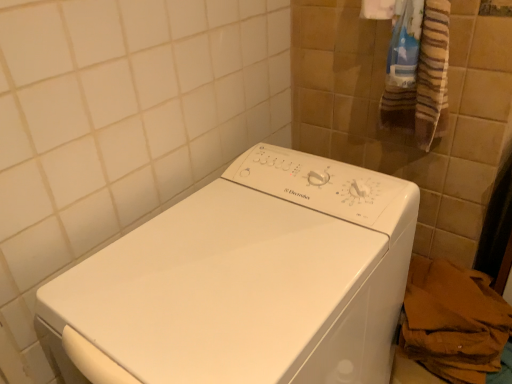
Question: Is white glossy washing machine at center positioned before brown paper bag at lower right?

Choices:
 (A) no
 (B) yes

Answer: (B)

Question: Does white glossy washing machine at center have a greater height compared to brown paper bag at lower right?

Choices:
 (A) yes
 (B) no

Answer: (A)

Question: Can you confirm if white glossy washing machine at center is bigger than brown paper bag at lower right?

Choices:
 (A) yes
 (B) no

Answer: (A)

Question: From a real-world perspective, is white glossy washing machine at center positioned over brown paper bag at lower right based on gravity?

Choices:
 (A) no
 (B) yes

Answer: (B)

Question: Is white glossy washing machine at center turned away from brown paper bag at lower right?

Choices:
 (A) no
 (B) yes

Answer: (A)

Question: From a real-world perspective, is striped cotton bath towel at upper right physically located above or below white glossy washing machine at center?

Choices:
 (A) below
 (B) above

Answer: (B)

Question: Is striped cotton bath towel at upper right taller or shorter than white glossy washing machine at center?

Choices:
 (A) short
 (B) tall

Answer: (A)

Question: Looking at their shapes, would you say striped cotton bath towel at upper right is wider or thinner than white glossy washing machine at center?

Choices:
 (A) wide
 (B) thin

Answer: (B)

Question: Considering the positions of point (442, 79) and point (104, 254), is point (442, 79) closer or farther from the camera than point (104, 254)?

Choices:
 (A) closer
 (B) farther

Answer: (B)

Question: In terms of width, does brown paper bag at lower right look wider or thinner when compared to striped cotton bath towel at upper right?

Choices:
 (A) wide
 (B) thin

Answer: (A)

Question: From a real-world perspective, is brown paper bag at lower right positioned above or below striped cotton bath towel at upper right?

Choices:
 (A) below
 (B) above

Answer: (A)

Question: Is point (409, 322) positioned closer to the camera than point (421, 114)?

Choices:
 (A) farther
 (B) closer

Answer: (A)

Question: Is brown paper bag at lower right taller or shorter than striped cotton bath towel at upper right?

Choices:
 (A) short
 (B) tall

Answer: (B)

Question: Looking at the image, does brown paper bag at lower right seem bigger or smaller compared to white glossy washing machine at center?

Choices:
 (A) small
 (B) big

Answer: (A)

Question: Is brown paper bag at lower right taller or shorter than white glossy washing machine at center?

Choices:
 (A) short
 (B) tall

Answer: (A)